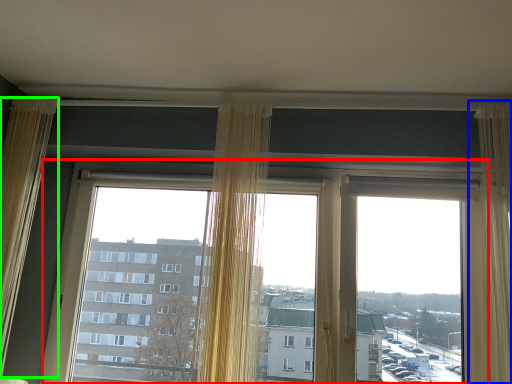
Question: Which object is the closest to the window (highlighted by a red box)? Choose among these: curtain (highlighted by a blue box) or curtain (highlighted by a green box).

Choices:
 (A) curtain
 (B) curtain

Answer: (B)